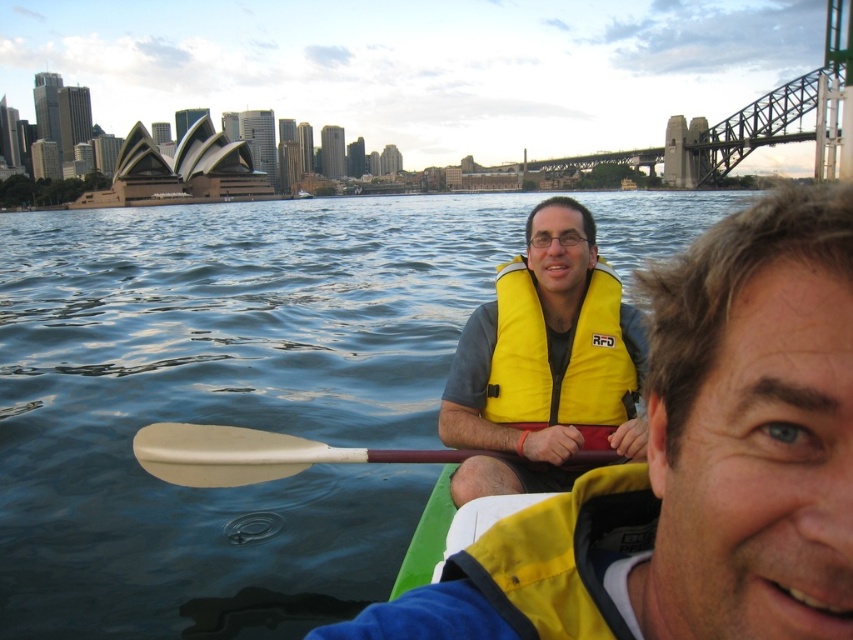
Is point (451, 352) closer to viewer compared to point (602, 296)?

That is False.

Is dark blue water at center to the right of yellow life vest at center from the viewer's perspective?

In fact, dark blue water at center is to the left of yellow life vest at center.

Where is `dark blue water at center`? The height and width of the screenshot is (640, 853). dark blue water at center is located at coordinates (224, 403).

At what (x,y) coordinates should I click in order to perform the action: click on dark blue water at center. Please return your answer as a coordinate pair (x, y). Image resolution: width=853 pixels, height=640 pixels. Looking at the image, I should click on (224, 403).

Does point (556, 396) come closer to viewer compared to point (538, 307)?

Yes.

In order to click on yellow life vest at center in this screenshot , I will do `click(544, 364)`.

Who is more forward, (531, 324) or (611, 301)?

Point (531, 324) is more forward.

Locate an element on the screen. The image size is (853, 640). yellow life vest at center is located at coordinates (544, 364).

Does dark blue water at center appear on the left side of yellow fabric life vest at center?

Yes, dark blue water at center is to the left of yellow fabric life vest at center.

The image size is (853, 640). Describe the element at coordinates (224, 403) in the screenshot. I see `dark blue water at center` at that location.

Identify the location of dark blue water at center. The height and width of the screenshot is (640, 853). (224, 403).

The width and height of the screenshot is (853, 640). What are the coordinates of `dark blue water at center` in the screenshot? It's located at (224, 403).